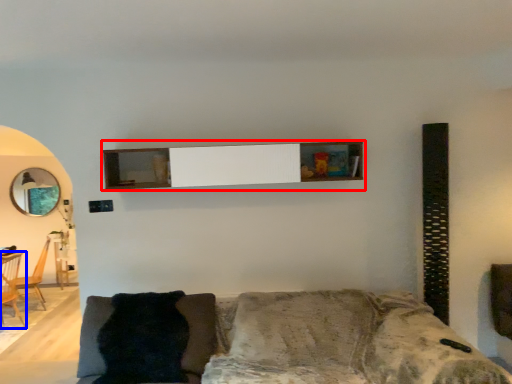
Question: Which of the following is the farthest to the observer, shelf (highlighted by a red box) or armchair (highlighted by a blue box)?

Choices:
 (A) shelf
 (B) armchair

Answer: (B)